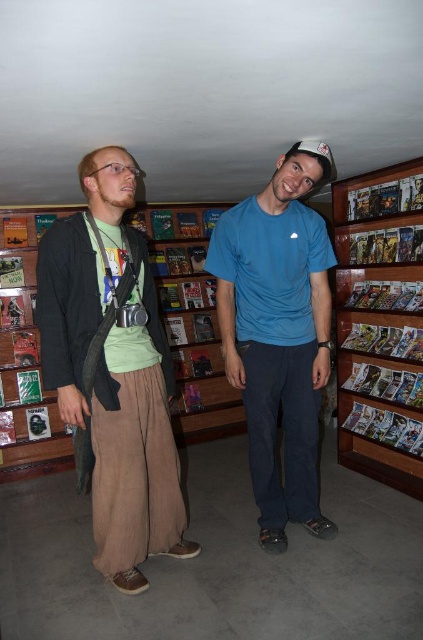
Question: Among these objects, which one is farthest from the camera?

Choices:
 (A) wooden bookshelf at right
 (B) matte green t-shirt at center

Answer: (A)

Question: Is matte green t-shirt at center wider than wooden bookshelf at right?

Choices:
 (A) yes
 (B) no

Answer: (A)

Question: From the image, what is the correct spatial relationship of matte green t-shirt at center in relation to blue cotton t-shirt at center?

Choices:
 (A) above
 (B) below

Answer: (B)

Question: Considering the relative positions of matte green t-shirt at center and wooden bookshelf at center in the image provided, where is matte green t-shirt at center located with respect to wooden bookshelf at center?

Choices:
 (A) below
 (B) above

Answer: (A)

Question: Which of these objects is positioned closest to the wooden bookshelf at right?

Choices:
 (A) matte green t-shirt at center
 (B) wooden bookshelf at center
 (C) blue cotton t-shirt at center

Answer: (C)

Question: Which of these objects is positioned closest to the matte green t-shirt at center?

Choices:
 (A) wooden bookshelf at right
 (B) wooden bookshelf at center
 (C) blue cotton t-shirt at center

Answer: (C)